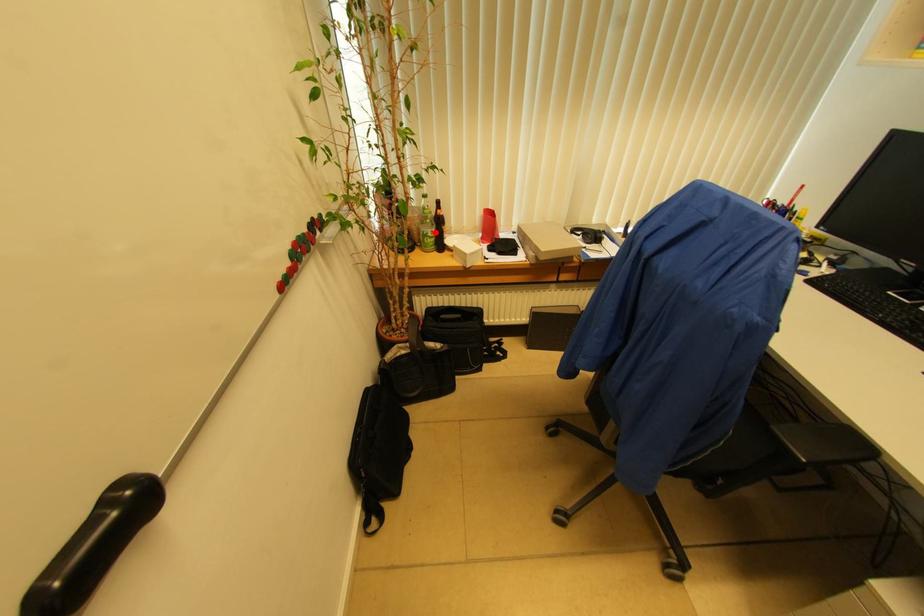
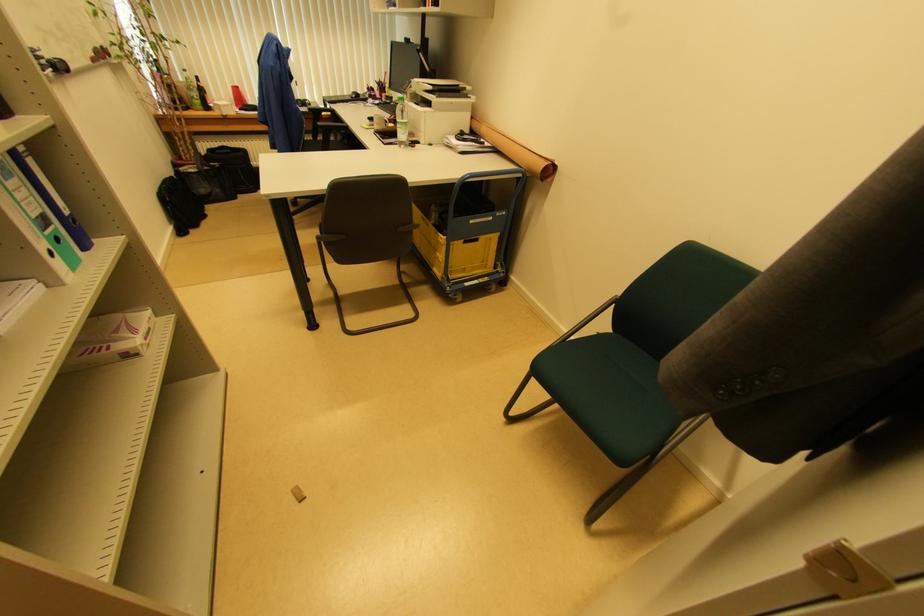
Find the pixel in the second image that matches the highlighted location in the first image.

(200, 98)